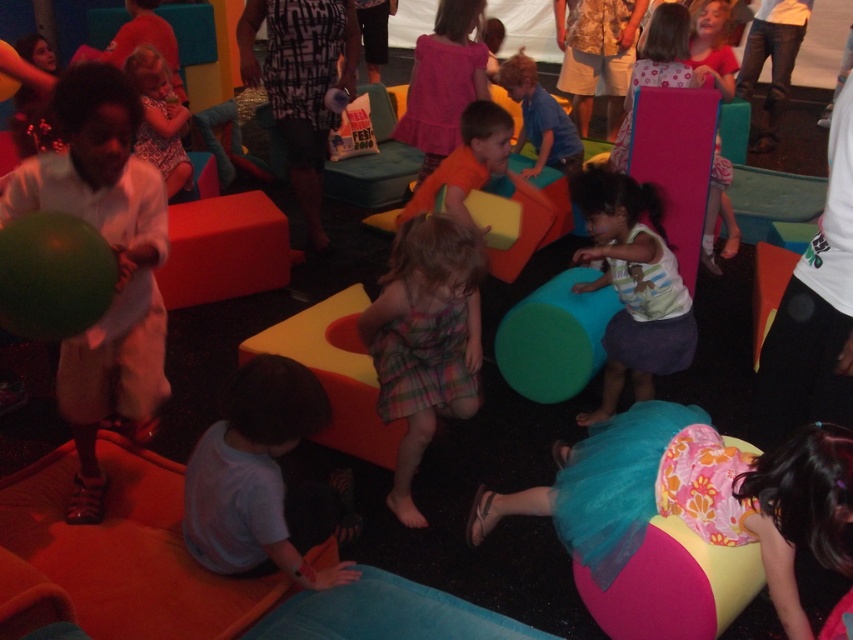
Is green rubber ball at left positioned in front of green rubber cylinder at center?

Yes, green rubber ball at left is in front of green rubber cylinder at center.

Between point (9, 230) and point (521, 353), which one is positioned behind?

The point (521, 353) is behind.

Is point (39, 221) in front of point (560, 339)?

That is True.

Locate an element on the screen. The image size is (853, 640). green rubber ball at left is located at coordinates (53, 275).

Can you confirm if white striped shirt at center is shorter than matte floral dress at upper left?

In fact, white striped shirt at center may be taller than matte floral dress at upper left.

In the scene shown: Does white striped shirt at center have a smaller size compared to matte floral dress at upper left?

Actually, white striped shirt at center might be larger than matte floral dress at upper left.

Describe the element at coordinates (631, 285) in the screenshot. I see `white striped shirt at center` at that location.

Where is `white striped shirt at center`? The width and height of the screenshot is (853, 640). white striped shirt at center is located at coordinates (631, 285).

Is point (579, 300) positioned behind point (521, 88)?

That is False.

Does green rubber cylinder at center appear under blue shirt at center?

Correct, green rubber cylinder at center is located below blue shirt at center.

Which is in front, point (537, 394) or point (567, 138)?

Positioned in front is point (537, 394).

Find the location of a particular element. The height and width of the screenshot is (640, 853). green rubber cylinder at center is located at coordinates (554, 337).